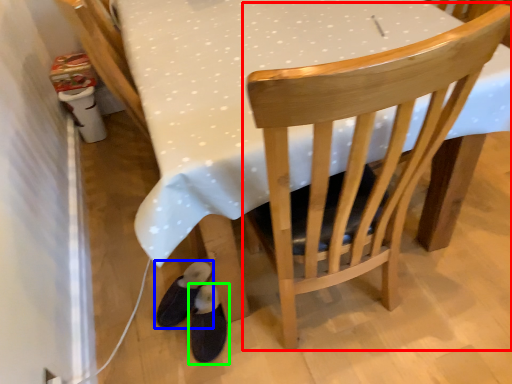
Question: Which object is positioned farthest from chair (highlighted by a red box)? Select from footwear (highlighted by a blue box) and footwear (highlighted by a green box).

Choices:
 (A) footwear
 (B) footwear

Answer: (A)